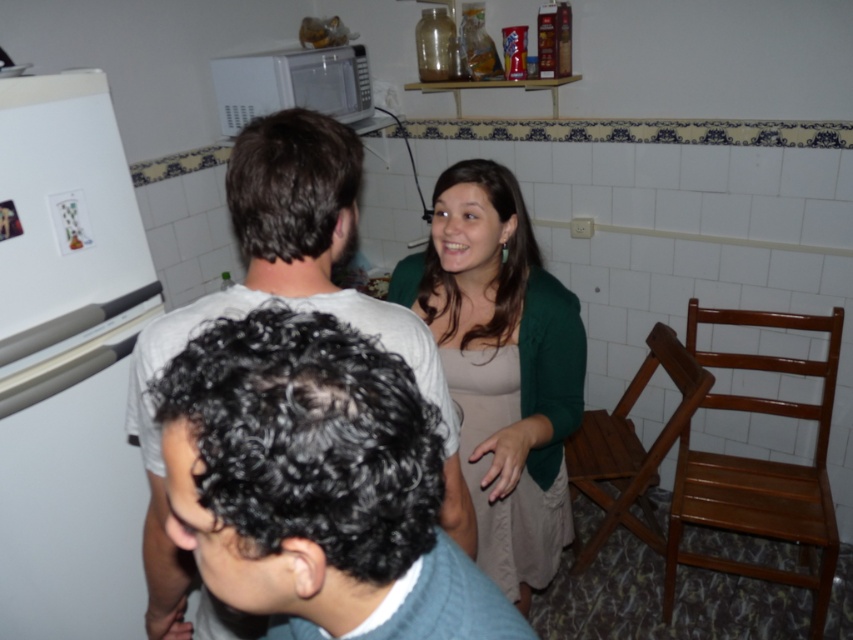
Question: Considering the relative positions of dark brown hair at center and white matte microwave at upper center in the image provided, where is dark brown hair at center located with respect to white matte microwave at upper center?

Choices:
 (A) right
 (B) left

Answer: (A)

Question: Is the position of white matte refrigerator at left more distant than that of white matte microwave at upper center?

Choices:
 (A) no
 (B) yes

Answer: (A)

Question: Which object is closer to the camera taking this photo?

Choices:
 (A) white matte refrigerator at left
 (B) green matte dress at center
 (C) dark brown hair at center
 (D) white matte microwave at upper center

Answer: (C)

Question: Does white matte refrigerator at left appear on the right side of dark brown hair at center?

Choices:
 (A) yes
 (B) no

Answer: (B)

Question: Which of the following is the closest to the observer?

Choices:
 (A) (479, 278)
 (B) (70, 317)
 (C) (289, 154)

Answer: (C)

Question: Which object is positioned farthest from the white matte refrigerator at left?

Choices:
 (A) green matte dress at center
 (B) dark brown hair at center

Answer: (A)